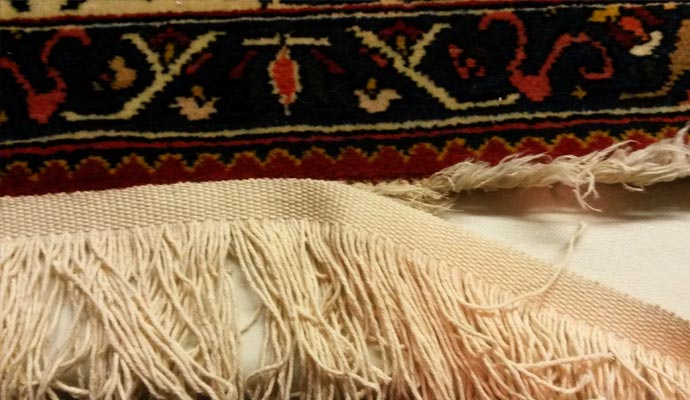
Locate an element on the screen. The image size is (690, 400). floor is located at coordinates pyautogui.click(x=633, y=271).